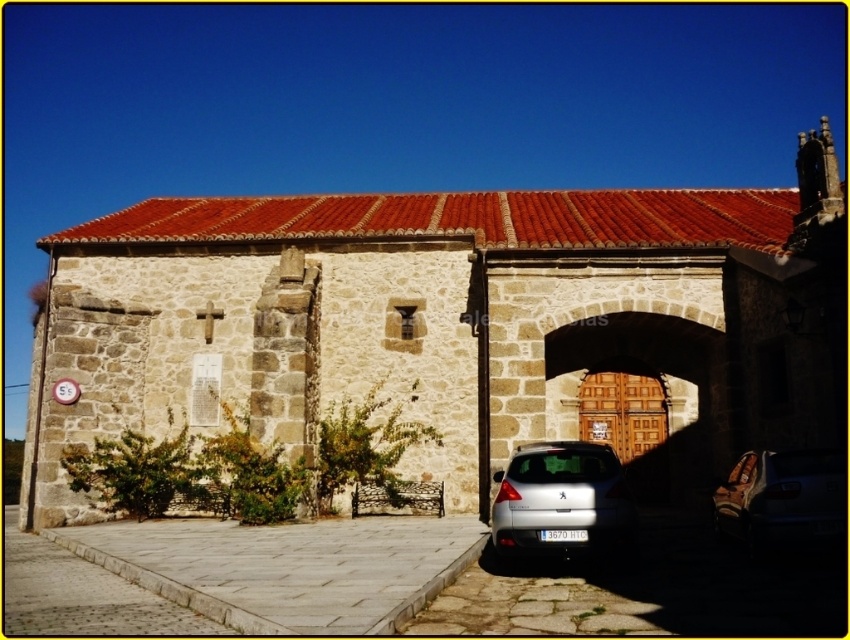
Is satin silver car at lower center to the left of metallic silver car at center from the viewer's perspective?

Yes, satin silver car at lower center is to the left of metallic silver car at center.

This screenshot has height=640, width=850. What do you see at coordinates (562, 500) in the screenshot?
I see `satin silver car at lower center` at bounding box center [562, 500].

Find the location of `satin silver car at lower center`. satin silver car at lower center is located at coordinates (562, 500).